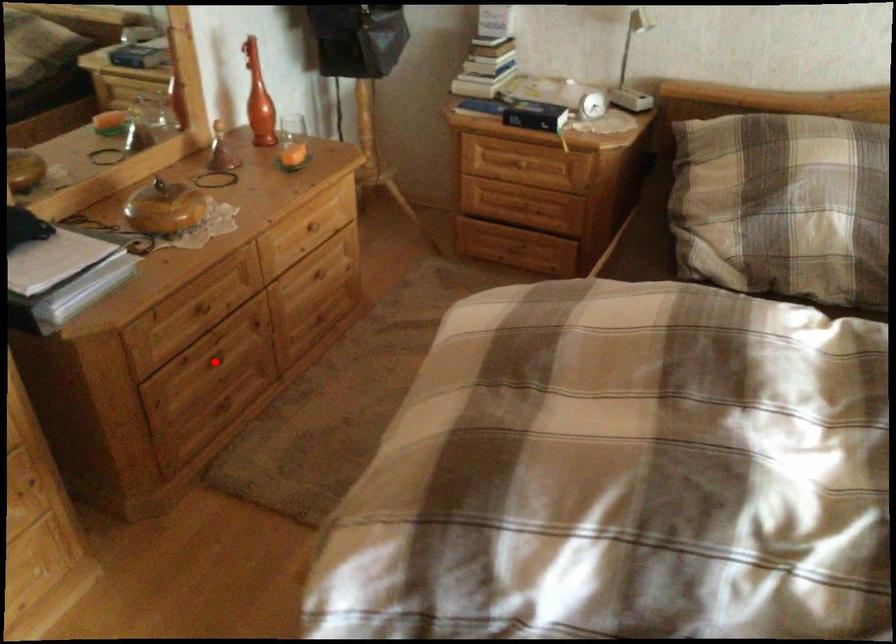
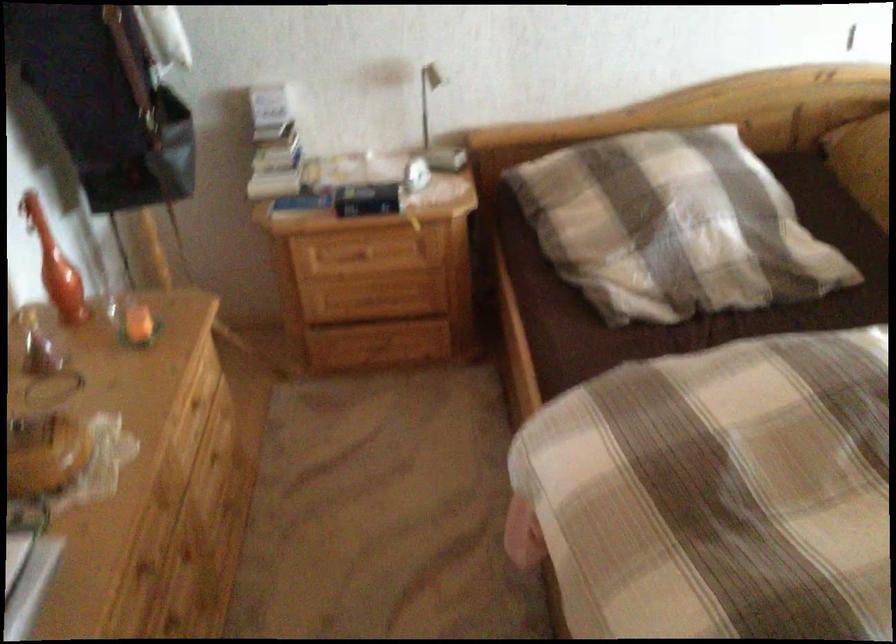
Find the pixel in the second image that matches the highlighted location in the first image.

(174, 627)